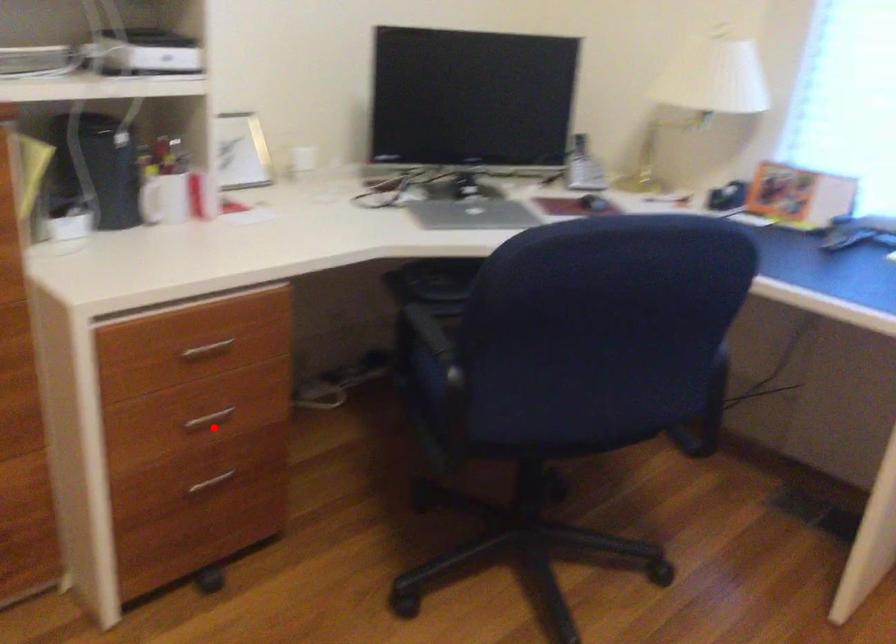
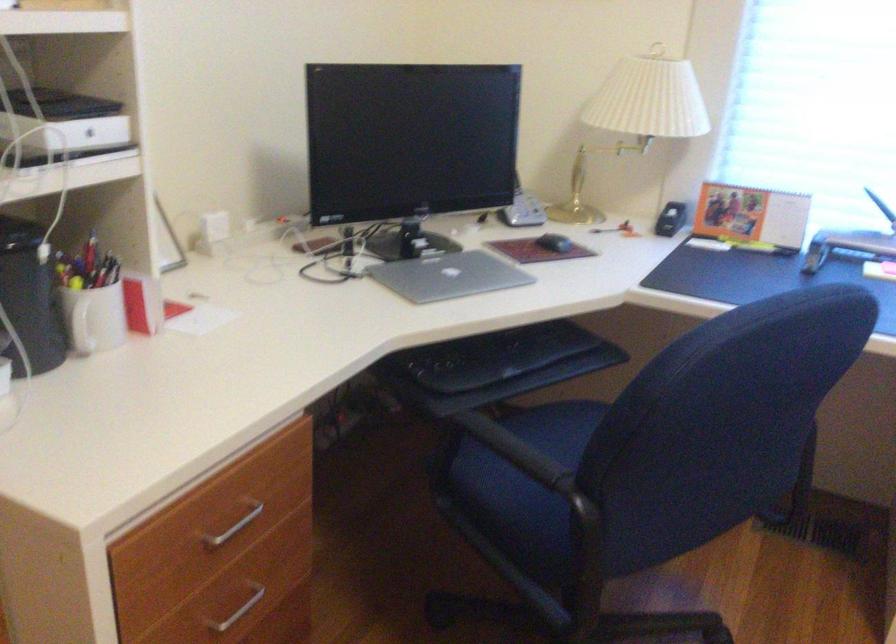
The point at the highlighted location is marked in the first image. Where is the corresponding point in the second image?

(238, 611)